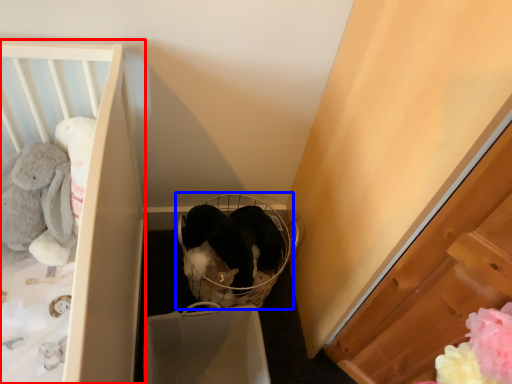
Question: Which object is further to the camera taking this photo, furniture (highlighted by a red box) or baby carriage (highlighted by a blue box)?

Choices:
 (A) furniture
 (B) baby carriage

Answer: (B)